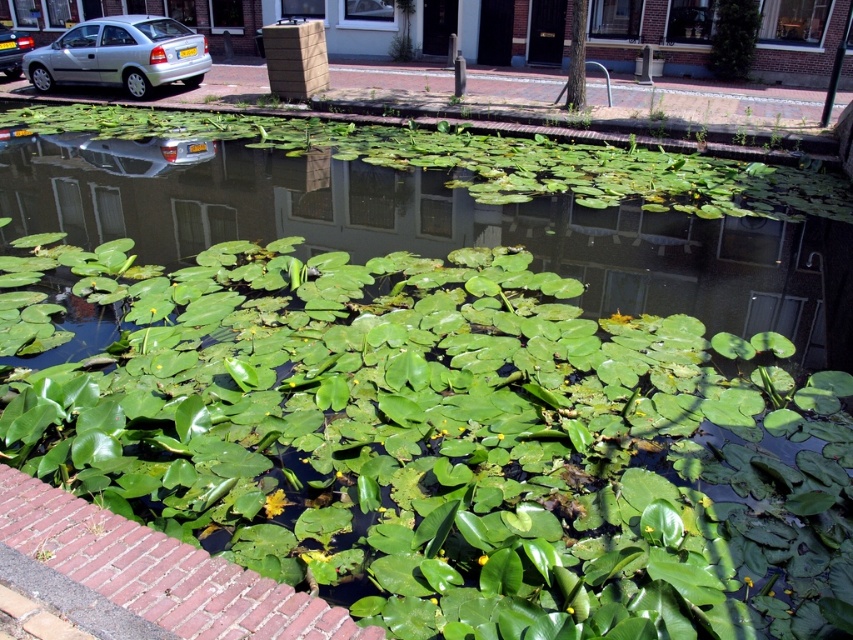
You are a delivery person who needs to park your small van between the green leafy plant at center and the silver metallic car at upper left. Can you fit your van there if the van requires 3 meters of space?

The green leafy plant at center occupies less space than the silver metallic car at upper left. However, the exact distance between them isn generated in the description. Therefore, it is unclear if there is enough space for the van requiring 3 meters.

You are a delivery person who needs to park your delivery van between the green leafy plant at center and the silver metallic car at upper left. Can your van, which is 2 meters wide, fit in the space between them?

The green leafy plant at center is thinner than the silver metallic car at upper left, but the description does not provide the exact width of the space between them. Therefore, it is uncertain if the van can fit.